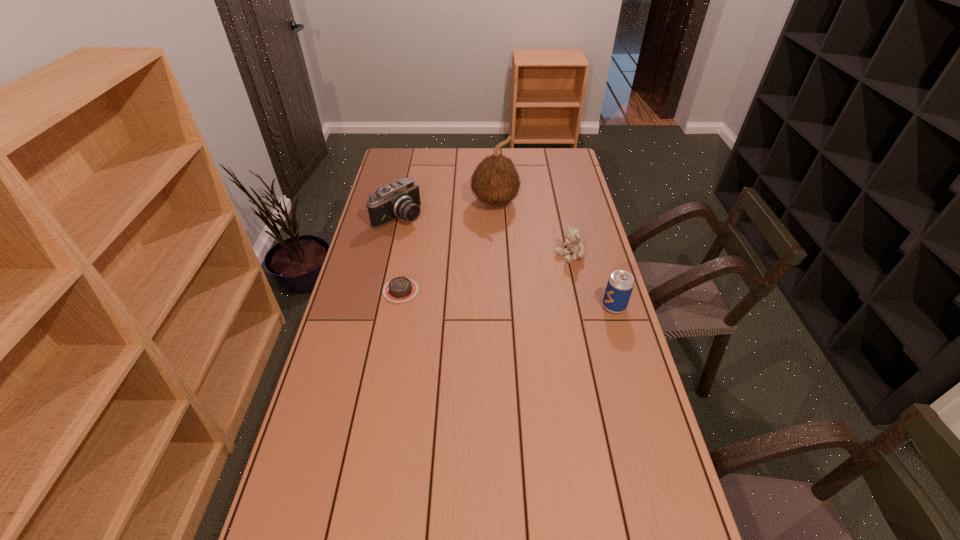
Where is `vacant region located on the face of the third farthest object`? vacant region located on the face of the third farthest object is located at coordinates (498, 285).

This screenshot has height=540, width=960. Identify the location of vacant space located on the face of the third farthest object. (493, 287).

You are a GUI agent. You are given a task and a screenshot of the screen. Output one action in this format:
    pyautogui.click(x=<x>, y=<y>)
    Task: Click on the free location located on the front-facing side of the camera
    
    Given the screenshot: What is the action you would take?
    pyautogui.click(x=461, y=259)

Where is `free space located on the front-facing side of the camera`? This screenshot has width=960, height=540. free space located on the front-facing side of the camera is located at coordinates (438, 242).

This screenshot has height=540, width=960. I want to click on blank space located 0.390m on the front-facing side of the camera, so click(x=481, y=273).

The width and height of the screenshot is (960, 540). I want to click on vacant region located on the surface of the third object from right to left, so click(506, 252).

Where is `vacant space located on the surface of the third object from right to left`? vacant space located on the surface of the third object from right to left is located at coordinates (502, 234).

I want to click on vacant space located 0.370m on the surface of the third object from right to left, so [512, 280].

Find the location of a particular element. chocolate cake at the left edge is located at coordinates 400,289.

Identify the location of camera located in the left edge section of the desktop. (401, 199).